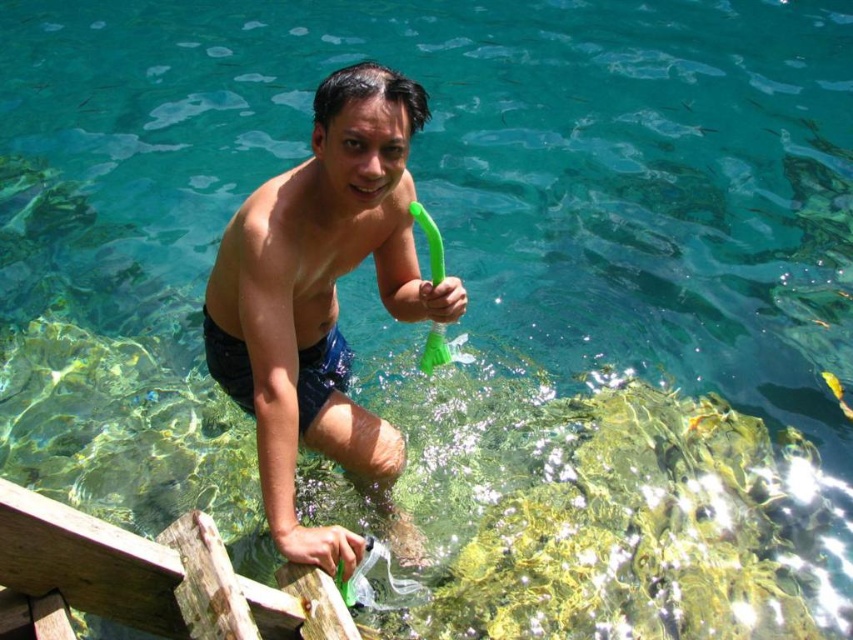
Question: Where is shiny blue shorts at center located in relation to dark blue fabric shorts at center in the image?

Choices:
 (A) below
 (B) above

Answer: (B)

Question: Observing the image, what is the correct spatial positioning of shiny blue shorts at center in reference to dark blue fabric shorts at center?

Choices:
 (A) below
 (B) above

Answer: (B)

Question: Does shiny blue shorts at center appear under dark blue fabric shorts at center?

Choices:
 (A) yes
 (B) no

Answer: (B)

Question: Which of the following is the farthest from the observer?

Choices:
 (A) (306, 164)
 (B) (213, 337)

Answer: (B)